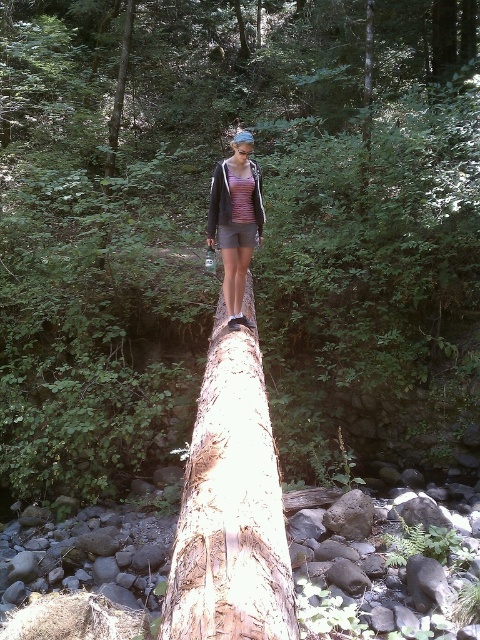
Question: From the image, what is the correct spatial relationship of light brown rough tree trunk at center in relation to matte purple tank top at center?

Choices:
 (A) above
 (B) below

Answer: (B)

Question: Among these objects, which one is farthest from the camera?

Choices:
 (A) light brown rough tree trunk at center
 (B) matte purple tank top at center

Answer: (B)

Question: Which point is closer to the camera?

Choices:
 (A) (220, 228)
 (B) (224, 428)

Answer: (B)

Question: Can you confirm if light brown rough tree trunk at center is positioned below matte purple tank top at center?

Choices:
 (A) no
 (B) yes

Answer: (B)

Question: Does light brown rough tree trunk at center lie behind matte purple tank top at center?

Choices:
 (A) no
 (B) yes

Answer: (A)